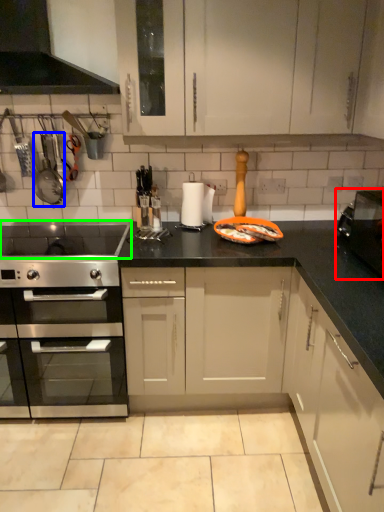
Question: Which object is the closest to the appliance (highlighted by a red box)? Choose among these: appliance (highlighted by a blue box) or gas stove (highlighted by a green box).

Choices:
 (A) appliance
 (B) gas stove

Answer: (B)